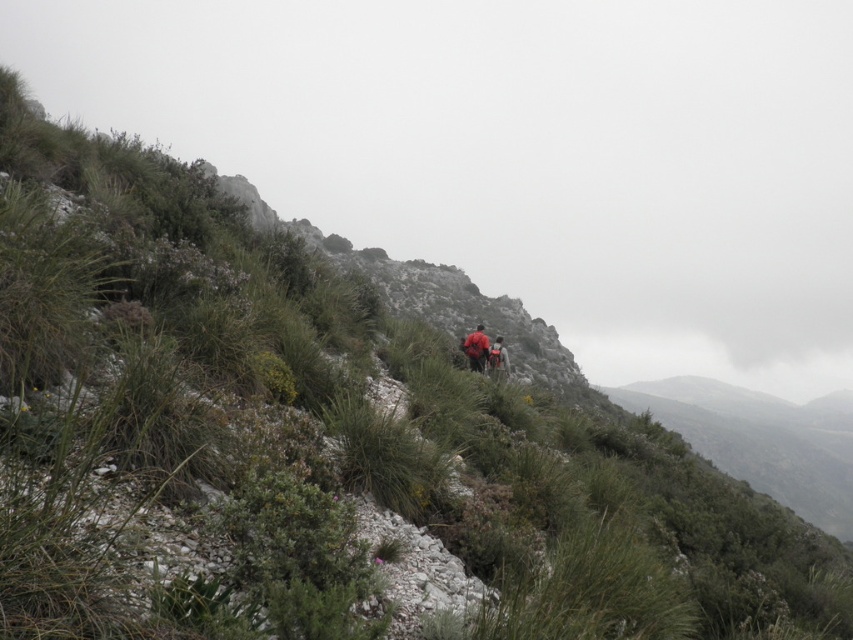
You are a hiker planning to carry both the red fabric backpack at center and the orange fabric backpack at center up the mountain. Given the terrain described, which backpack would be more suitable to carry first based on their sizes?

The red fabric backpack at center occupies less space than the orange fabric backpack at center, so it would be more suitable to carry first as it is smaller and easier to maneuver through the rocky and uneven terrain.

You are a hiker trying to locate your red fabric backpack at center in a rugged mountainous area. According to the coordinates provided, where exactly is the red fabric backpack positioned?

The red fabric backpack at center is located at point (x=476, y=348).

You are a hiker looking at the scene from the bottom of the slope. You see two hikers ahead with their red fabric backpack at center and orange fabric backpack at center. Which backpack is higher up on the slope?

The red fabric backpack at center is higher up on the slope because it is located above the orange fabric backpack at center.